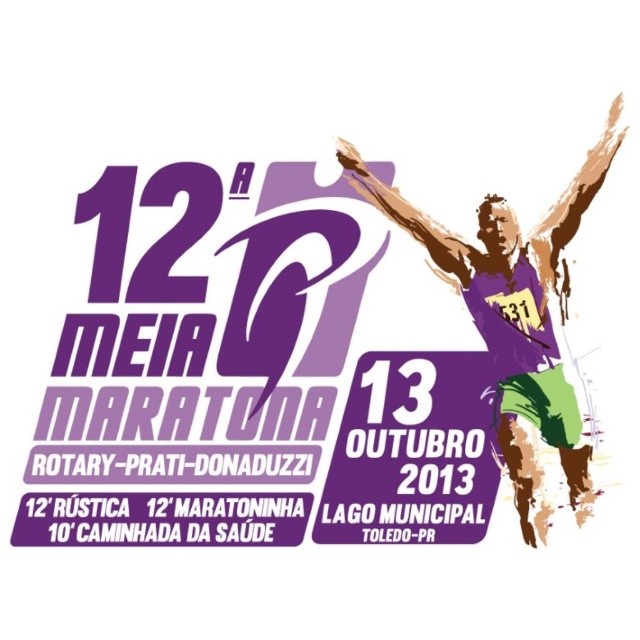
You are standing in front of the promotional graphic for the 12th Rotary Prati Donaduzzi Half Marathon. You want to know if you can reach the purple matte jersey at upper right with a 3.5 feet long pole. Can you do it?

The purple matte jersey at upper right is 3.76 feet away from the viewer. Since the pole is only 3.5 feet long, it is not long enough to reach the jersey.

In the promotional graphic for the 12th Rotary Prati Donaduzzi Half Marathon, there are two purple elements present. The first is the purple matte jersey at upper right and the second is the purple paper at center. From an observer looking at the image, which of these two purple items is located to the right of the other?

The purple matte jersey at upper right is positioned on the right side of the purple paper at center.